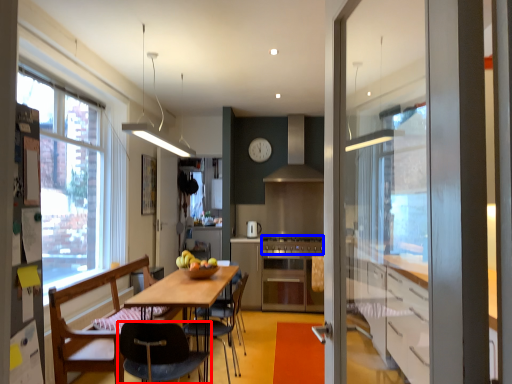
Question: Which object appears closest to the camera in this image, chair (highlighted by a red box) or stove (highlighted by a blue box)?

Choices:
 (A) chair
 (B) stove

Answer: (A)